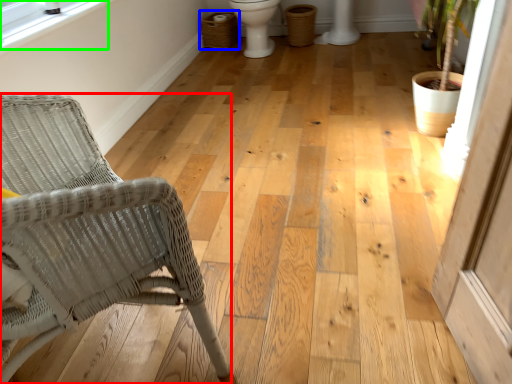
Question: Which is nearer to the chair (highlighted by a red box)? laundry basket (highlighted by a blue box) or window screen (highlighted by a green box).

Choices:
 (A) laundry basket
 (B) window screen

Answer: (B)